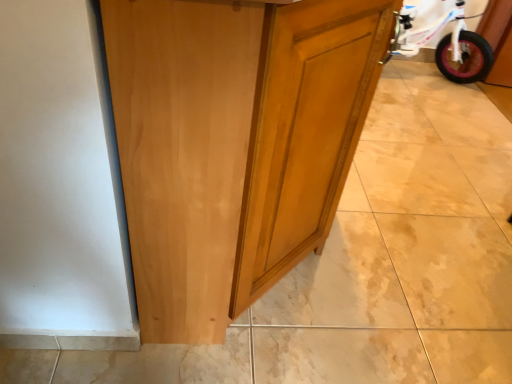
Question: From a real-world perspective, is glossy wood cupboard at center physically below pink rubber tire at right?

Choices:
 (A) no
 (B) yes

Answer: (A)

Question: From a real-world perspective, is glossy wood cupboard at center located higher than pink rubber tire at right?

Choices:
 (A) no
 (B) yes

Answer: (B)

Question: Is glossy wood cupboard at center directly adjacent to pink rubber tire at right?

Choices:
 (A) yes
 (B) no

Answer: (B)

Question: From the image's perspective, would you say glossy wood cupboard at center is positioned over pink rubber tire at right?

Choices:
 (A) no
 (B) yes

Answer: (A)

Question: Would you say glossy wood cupboard at center is a long distance from pink rubber tire at right?

Choices:
 (A) yes
 (B) no

Answer: (A)

Question: Does glossy wood cupboard at center have a lesser height compared to pink rubber tire at right?

Choices:
 (A) no
 (B) yes

Answer: (A)

Question: Can you confirm if pink rubber tire at right is shorter than glossy wood cupboard at center?

Choices:
 (A) yes
 (B) no

Answer: (A)

Question: Does pink rubber tire at right lie behind glossy wood cupboard at center?

Choices:
 (A) no
 (B) yes

Answer: (B)

Question: From a real-world perspective, is pink rubber tire at right located higher than glossy wood cupboard at center?

Choices:
 (A) yes
 (B) no

Answer: (B)

Question: Is pink rubber tire at right next to glossy wood cupboard at center?

Choices:
 (A) no
 (B) yes

Answer: (A)

Question: Can we say pink rubber tire at right lies outside glossy wood cupboard at center?

Choices:
 (A) yes
 (B) no

Answer: (A)

Question: Is pink rubber tire at right taller than glossy wood cupboard at center?

Choices:
 (A) yes
 (B) no

Answer: (B)

Question: Is pink rubber tire at right bigger or smaller than glossy wood cupboard at center?

Choices:
 (A) small
 (B) big

Answer: (A)